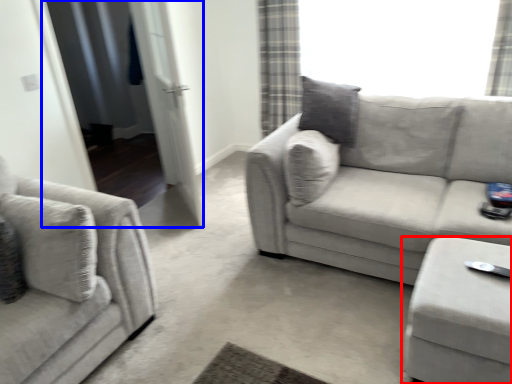
Question: Which object is further to the camera taking this photo, table (highlighted by a red box) or screen door (highlighted by a blue box)?

Choices:
 (A) table
 (B) screen door

Answer: (B)